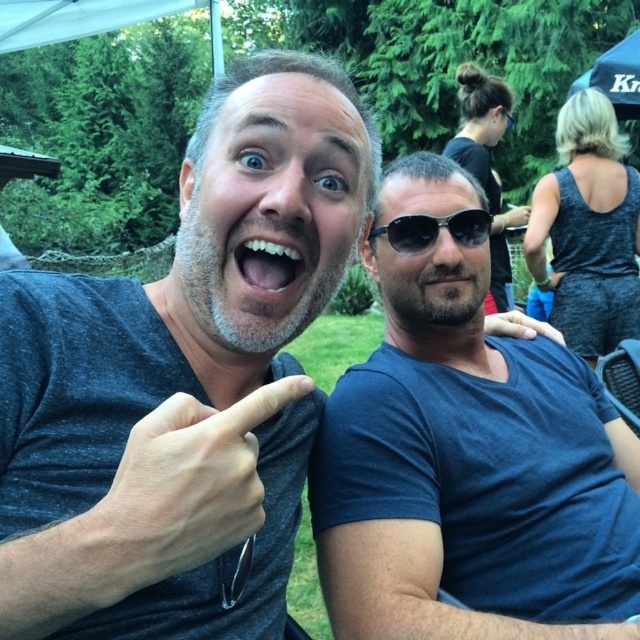
You are a photographer adjusting your camera to focus on the two subjects in the image. Since both the matte gray finger at center and the white glossy teeth at center are in your frame, which one would appear larger in your viewfinder?

The matte gray finger at center would appear larger in the viewfinder because it is closer to the viewer than the white glossy teeth at center.

You are standing in the park and see the blue fabric canopy at upper right and the matte black hand at upper right. Which object is closer to you?

The blue fabric canopy at upper right is closer to you because it is further to the viewer than the matte black hand at upper right.